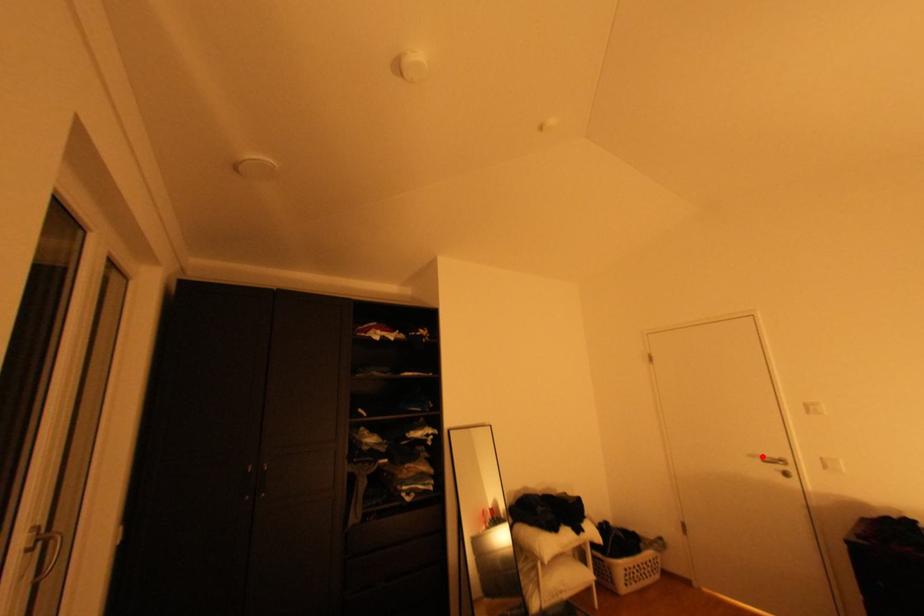
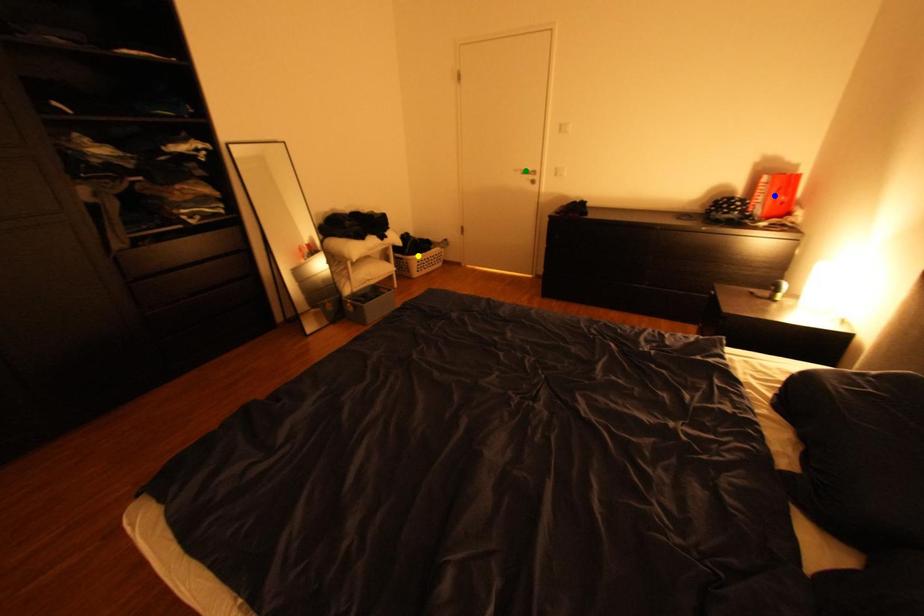
Question: I am providing you with two images of the same scene from different viewpoints. A red point is marked on the first image. You are given multiple points on the second image. Which mark in image 2 goes with the point in image 1?

Choices:
 (A) green point
 (B) blue point
 (C) yellow point

Answer: (A)